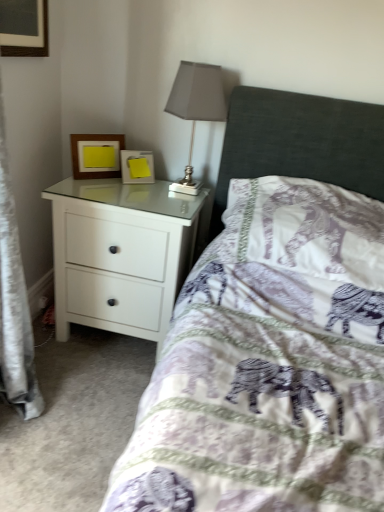
Describe the element at coordinates (96, 155) in the screenshot. I see `wooden picture frame at upper left, the second picture frame in the right-to-left sequence` at that location.

Measure the distance between white glossy chest of drawers at left and camera.

white glossy chest of drawers at left is 1.42 meters away from camera.

In order to face white glossy chest of drawers at left, should I rotate leftwards or rightwards?

Rotate left and turn 8.076 degrees.

Locate an element on the screen. This screenshot has width=384, height=512. wooden picture frame at upper left, the second picture frame in the right-to-left sequence is located at coordinates (96, 155).

Between matte gray lampshade at upper center and wooden picture frame at upper left, placed as the first picture frame when sorted from left to right, which one appears on the left side from the viewer's perspective?

wooden picture frame at upper left, placed as the first picture frame when sorted from left to right.

Looking at this image, is wooden picture frame at upper left, the second picture frame in the right-to-left sequence, surrounded by matte gray lampshade at upper center?

Definitely not — wooden picture frame at upper left, the second picture frame in the right-to-left sequence, is not inside matte gray lampshade at upper center.

The image size is (384, 512). I want to click on table lamp located above the wooden picture frame at upper left, placed as the first picture frame when sorted from left to right (from the image's perspective), so click(x=196, y=106).

Considering the relative sizes of matte gray lampshade at upper center and wooden picture frame at upper left, placed as the first picture frame when sorted from left to right, in the image provided, is matte gray lampshade at upper center shorter than wooden picture frame at upper left, placed as the first picture frame when sorted from left to right,?

Incorrect, the height of matte gray lampshade at upper center does not fall short of that of wooden picture frame at upper left, placed as the first picture frame when sorted from left to right.

Based on the photo, is wooden picture frame at upper left, placed as the first picture frame when sorted from left to right, oriented away from purple elephant-patterned pillow at center?

No, purple elephant-patterned pillow at center is not at the back of wooden picture frame at upper left, placed as the first picture frame when sorted from left to right.

Which object is wider, wooden picture frame at upper left, the second picture frame in the right-to-left sequence, or purple elephant-patterned pillow at center?

purple elephant-patterned pillow at center is wider.

In the image, there is a wooden picture frame at upper left, the second picture frame in the right-to-left sequence. Where is `pillow below it (from the image's perspective)`? This screenshot has height=512, width=384. pillow below it (from the image's perspective) is located at coordinates (307, 228).

Can you tell me how much wooden picture frame at upper left, placed as the first picture frame when sorted from left to right, and purple elephant-patterned pillow at center differ in facing direction?

They differ by 43 degrees in their facing directions.

Can you tell me how much yellow paper at upper left, the 2th picture frame when ordered from left to right, and matte gray lampshade at upper center differ in facing direction?

The angle between the facing direction of yellow paper at upper left, the 2th picture frame when ordered from left to right, and the facing direction of matte gray lampshade at upper center is 39.9 degrees.

Considering the relative positions of yellow paper at upper left, the 2th picture frame when ordered from left to right, and matte gray lampshade at upper center in the image provided, is yellow paper at upper left, the 2th picture frame when ordered from left to right, to the right of matte gray lampshade at upper center from the viewer's perspective?

A: In fact, yellow paper at upper left, the 2th picture frame when ordered from left to right, is to the left of matte gray lampshade at upper center.

Can you confirm if yellow paper at upper left, the 2th picture frame when ordered from left to right, is bigger than matte gray lampshade at upper center?

No.

From the image's perspective, would you say yellow paper at upper left, the 2th picture frame when ordered from left to right, is shown under matte gray lampshade at upper center?

Indeed, from the image's perspective, yellow paper at upper left, the 2th picture frame when ordered from left to right, is shown beneath matte gray lampshade at upper center.

Is point (135, 152) positioned in front of point (95, 158)?

No.

From a real-world perspective, between yellow paper at upper left, the 2th picture frame when ordered from left to right, and wooden picture frame at upper left, the second picture frame in the right-to-left sequence, who is vertically lower?

In real-world perspective, yellow paper at upper left, the 2th picture frame when ordered from left to right, is lower.

Does yellow paper at upper left, which is counted as the first picture frame, starting from the right, have a smaller size compared to wooden picture frame at upper left, the second picture frame in the right-to-left sequence?

Correct, yellow paper at upper left, which is counted as the first picture frame, starting from the right, occupies less space than wooden picture frame at upper left, the second picture frame in the right-to-left sequence.

Is yellow paper at upper left, the 2th picture frame when ordered from left to right, not inside wooden picture frame at upper left, the second picture frame in the right-to-left sequence?

Yes.

Who is taller, matte gray lampshade at upper center or white glossy chest of drawers at left?

white glossy chest of drawers at left.

Can you confirm if matte gray lampshade at upper center is bigger than white glossy chest of drawers at left?

Actually, matte gray lampshade at upper center might be smaller than white glossy chest of drawers at left.

Does matte gray lampshade at upper center have a greater width compared to white glossy chest of drawers at left?

No.

Does matte gray lampshade at upper center lie behind white glossy chest of drawers at left?

That is False.

Where is `chest of drawers below the yellow paper at upper left, the 2th picture frame when ordered from left to right (from a real-world perspective)`? The width and height of the screenshot is (384, 512). chest of drawers below the yellow paper at upper left, the 2th picture frame when ordered from left to right (from a real-world perspective) is located at coordinates (120, 254).

How many degrees apart are the facing directions of yellow paper at upper left, which is counted as the first picture frame, starting from the right, and white glossy chest of drawers at left?

The facing directions of yellow paper at upper left, which is counted as the first picture frame, starting from the right, and white glossy chest of drawers at left are 39.9 degrees apart.

Considering the positions of objects yellow paper at upper left, which is counted as the first picture frame, starting from the right, and white glossy chest of drawers at left in the image provided, who is more to the left, yellow paper at upper left, which is counted as the first picture frame, starting from the right, or white glossy chest of drawers at left?

From the viewer's perspective, white glossy chest of drawers at left appears more on the left side.

Can you see yellow paper at upper left, the 2th picture frame when ordered from left to right, touching white glossy chest of drawers at left?

There is a gap between yellow paper at upper left, the 2th picture frame when ordered from left to right, and white glossy chest of drawers at left.

The width and height of the screenshot is (384, 512). I want to click on chest of drawers lying on the left of yellow paper at upper left, the 2th picture frame when ordered from left to right, so click(120, 254).

Considering the relative sizes of white glossy chest of drawers at left and yellow paper at upper left, which is counted as the first picture frame, starting from the right, in the image provided, is white glossy chest of drawers at left smaller than yellow paper at upper left, which is counted as the first picture frame, starting from the right,?

No, white glossy chest of drawers at left is not smaller than yellow paper at upper left, which is counted as the first picture frame, starting from the right.

Is yellow paper at upper left, the 2th picture frame when ordered from left to right, at the back of white glossy chest of drawers at left?

No, white glossy chest of drawers at left is not facing away from yellow paper at upper left, the 2th picture frame when ordered from left to right.

In the image, is white glossy chest of drawers at left positioned in front of or behind yellow paper at upper left, the 2th picture frame when ordered from left to right?

Clearly, white glossy chest of drawers at left is in front of yellow paper at upper left, the 2th picture frame when ordered from left to right.

At what (x,y) coordinates should I click in order to perform the action: click on the 1st picture frame behind the matte gray lampshade at upper center, starting your count from the anchor. Please return your answer as a coordinate pair (x, y). This screenshot has width=384, height=512. Looking at the image, I should click on (96, 155).

You are a GUI agent. You are given a task and a screenshot of the screen. Output one action in this format:
    pyautogui.click(x=<x>, y=<y>)
    Task: Click on the pillow that appears on the right of wooden picture frame at upper left, placed as the first picture frame when sorted from left to right
    The width and height of the screenshot is (384, 512).
    Given the screenshot: What is the action you would take?
    pyautogui.click(x=307, y=228)

Which object lies nearer to the anchor point purple elephant-patterned pillow at center, wooden picture frame at upper left, the second picture frame in the right-to-left sequence, or white glossy chest of drawers at left?

The object closer to purple elephant-patterned pillow at center is white glossy chest of drawers at left.

Considering their positions, is white glossy chest of drawers at left positioned closer to matte gray lampshade at upper center than wooden picture frame at upper left, the second picture frame in the right-to-left sequence?

wooden picture frame at upper left, the second picture frame in the right-to-left sequence, is positioned closer to the anchor matte gray lampshade at upper center.

When comparing their distances from yellow paper at upper left, the 2th picture frame when ordered from left to right, does wooden picture frame at upper left, placed as the first picture frame when sorted from left to right, or matte gray lampshade at upper center seem further?

matte gray lampshade at upper center is further to yellow paper at upper left, the 2th picture frame when ordered from left to right.

Looking at the image, which one is located closer to wooden picture frame at upper left, placed as the first picture frame when sorted from left to right, white glossy chest of drawers at left or matte gray lampshade at upper center?

Among the two, white glossy chest of drawers at left is located nearer to wooden picture frame at upper left, placed as the first picture frame when sorted from left to right.

Estimate the real-world distances between objects in this image. Which object is further from matte gray lampshade at upper center, yellow paper at upper left, the 2th picture frame when ordered from left to right, or white glossy chest of drawers at left?

white glossy chest of drawers at left.

Considering their positions, is yellow paper at upper left, the 2th picture frame when ordered from left to right, positioned closer to purple elephant-patterned pillow at center than matte gray lampshade at upper center?

matte gray lampshade at upper center is positioned closer to the anchor purple elephant-patterned pillow at center.

Estimate the real-world distances between objects in this image. Which object is closer to white glossy chest of drawers at left, yellow paper at upper left, the 2th picture frame when ordered from left to right, or wooden picture frame at upper left, the second picture frame in the right-to-left sequence?

A: yellow paper at upper left, the 2th picture frame when ordered from left to right, lies closer to white glossy chest of drawers at left than the other object.

Estimate the real-world distances between objects in this image. Which object is further from wooden picture frame at upper left, placed as the first picture frame when sorted from left to right, yellow paper at upper left, which is counted as the first picture frame, starting from the right, or white glossy chest of drawers at left?

Among the two, white glossy chest of drawers at left is located further to wooden picture frame at upper left, placed as the first picture frame when sorted from left to right.

Identify the location of table lamp located between white glossy chest of drawers at left and purple elephant-patterned pillow at center in the left-right direction. This screenshot has height=512, width=384. (196, 106).

Where is `picture frame between white glossy chest of drawers at left and purple elephant-patterned pillow at center`? Image resolution: width=384 pixels, height=512 pixels. picture frame between white glossy chest of drawers at left and purple elephant-patterned pillow at center is located at coordinates (137, 167).

What are the coordinates of `table lamp situated between wooden picture frame at upper left, the second picture frame in the right-to-left sequence, and purple elephant-patterned pillow at center from left to right` in the screenshot? It's located at (196, 106).

Identify the location of picture frame situated between wooden picture frame at upper left, the second picture frame in the right-to-left sequence, and purple elephant-patterned pillow at center from left to right. (137, 167).